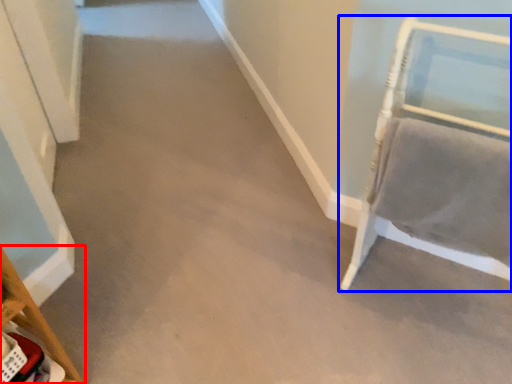
Question: Which object appears farthest to the camera in this image, furniture (highlighted by a red box) or furniture (highlighted by a blue box)?

Choices:
 (A) furniture
 (B) furniture

Answer: (A)